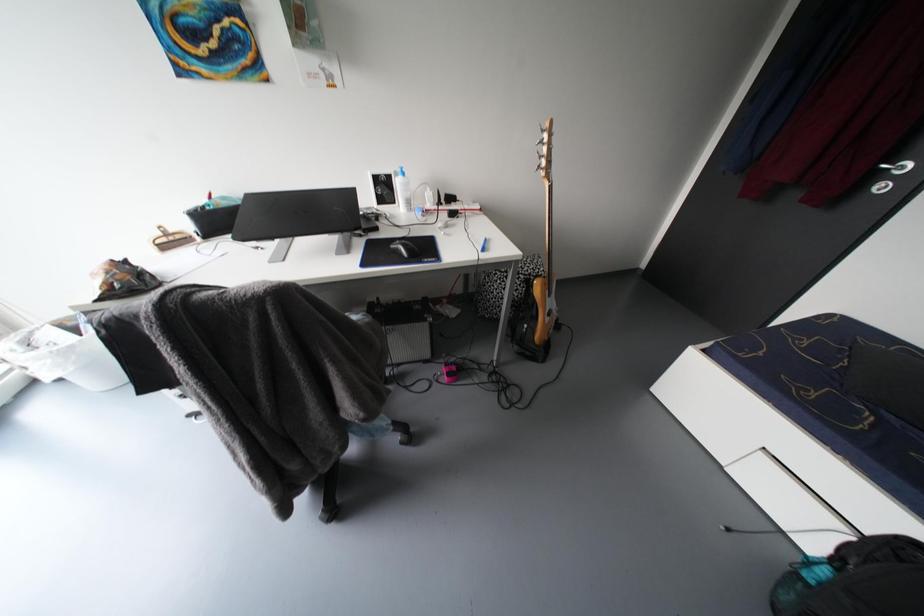
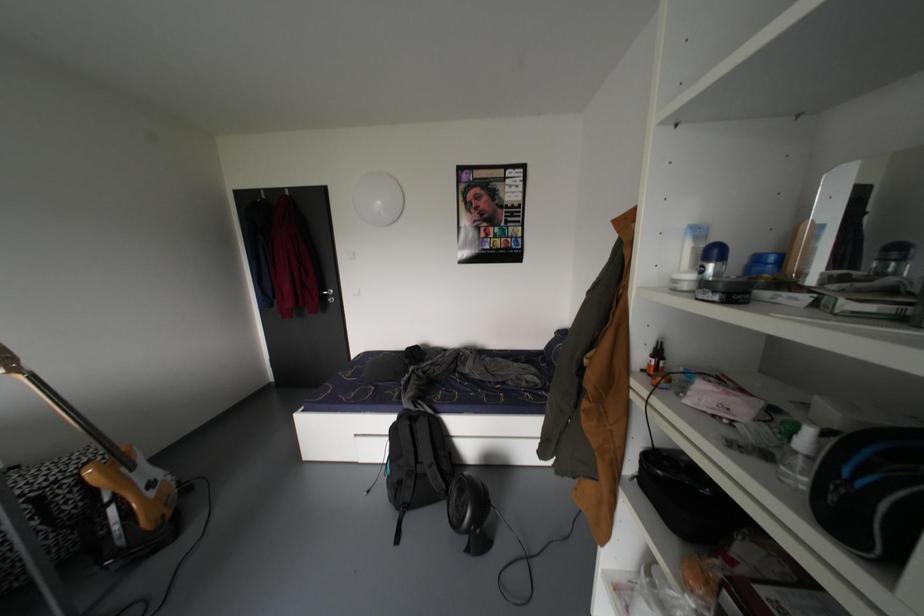
Question: How did the camera likely rotate?

Choices:
 (A) Left
 (B) Right
 (C) Up
 (D) Down

Answer: (B)